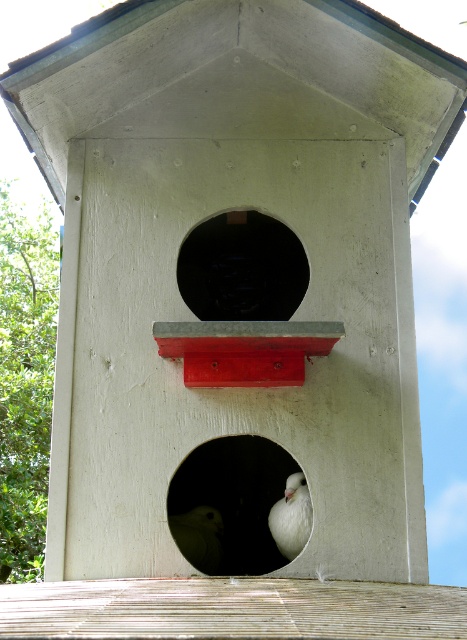
Is white matte bird at lower center further to the viewer compared to white matte bird at center?

No.

Can you confirm if white matte bird at lower center is positioned to the left of white matte bird at center?

Indeed, white matte bird at lower center is positioned on the left side of white matte bird at center.

What do you see at coordinates (198, 536) in the screenshot? This screenshot has height=640, width=467. I see `white matte bird at lower center` at bounding box center [198, 536].

The height and width of the screenshot is (640, 467). I want to click on white matte bird at lower center, so click(198, 536).

Can you confirm if white matte/porcelain hole at center is bigger than white matte bird at center?

Yes.

Between white matte/porcelain hole at center and white matte bird at center, which one has less height?

With less height is white matte bird at center.

At what (x,y) coordinates should I click in order to perform the action: click on white matte/porcelain hole at center. Please return your answer as a coordinate pair (x, y). Image resolution: width=467 pixels, height=640 pixels. Looking at the image, I should click on [x=228, y=504].

You are a GUI agent. You are given a task and a screenshot of the screen. Output one action in this format:
    pyautogui.click(x=<x>, y=<y>)
    Task: Click on the white matte/porcelain hole at center
    The image size is (467, 640).
    Given the screenshot: What is the action you would take?
    pyautogui.click(x=228, y=504)

In order to click on white matte/porcelain hole at center in this screenshot , I will do `click(228, 504)`.

Between white matte/porcelain hole at center and white matte bird at lower center, which one has less height?

Standing shorter between the two is white matte bird at lower center.

Which is behind, point (190, 502) or point (205, 545)?

The point (190, 502) is more distant.

Locate an element on the screen. This screenshot has height=640, width=467. white matte/porcelain hole at center is located at coordinates (228, 504).